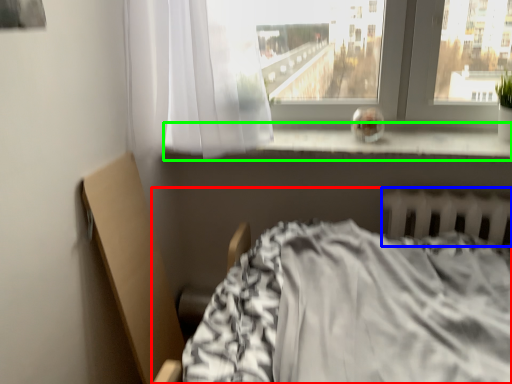
Question: Which object is positioned closest to bed (highlighted by a red box)? Select from radiator (highlighted by a blue box) and window sill (highlighted by a green box).

Choices:
 (A) radiator
 (B) window sill

Answer: (A)